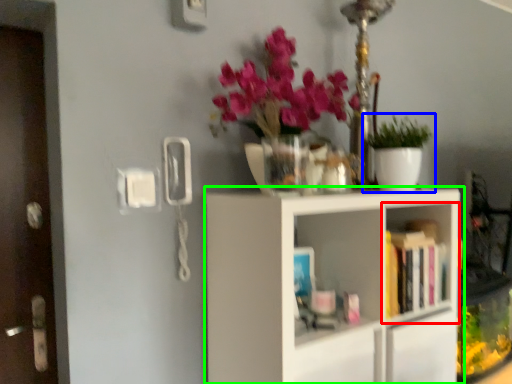
Question: Which is farther away from shelf (highlighted by a red box)? houseplant (highlighted by a blue box) or shelf (highlighted by a green box)?

Choices:
 (A) houseplant
 (B) shelf

Answer: (A)